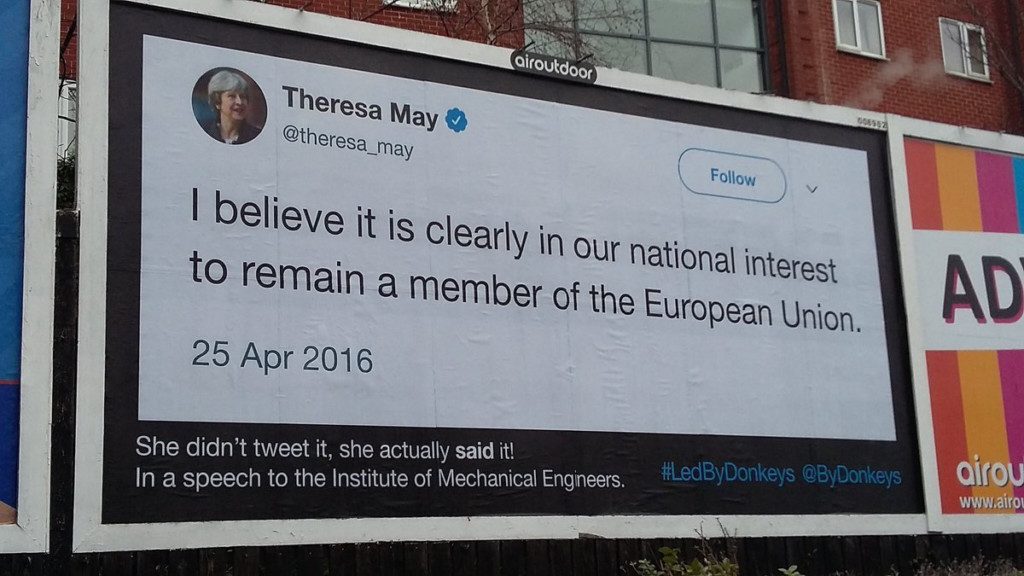
Identify the location of second from rightmost window. (864, 36).